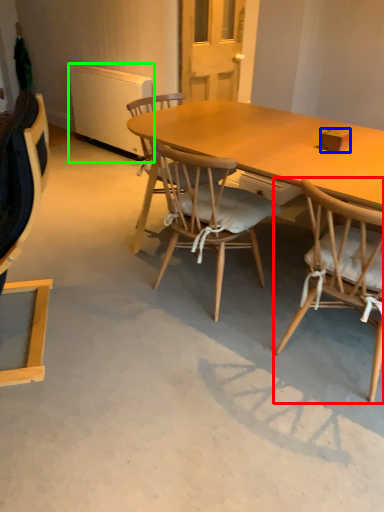
Question: Based on their relative distances, which object is farther from chair (highlighted by a red box)? Choose from box (highlighted by a blue box) and radiator (highlighted by a green box).

Choices:
 (A) box
 (B) radiator

Answer: (B)